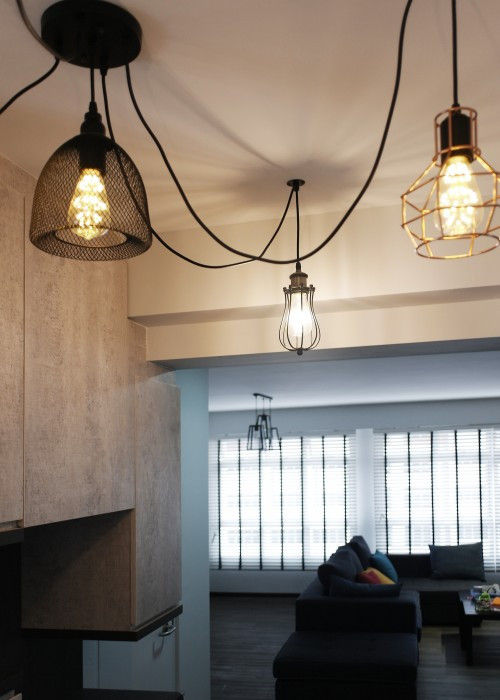
Where is `black wire light fixture`? This screenshot has height=700, width=500. black wire light fixture is located at coordinates point(54,190).